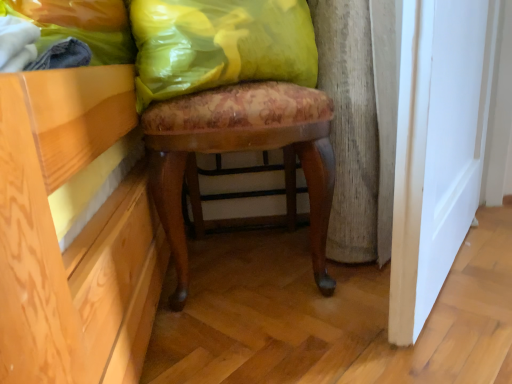
Question: Is yellow fabric pillow at upper center smaller than floral fabric stool at center?

Choices:
 (A) yes
 (B) no

Answer: (A)

Question: Is yellow fabric pillow at upper center positioned beyond the bounds of floral fabric stool at center?

Choices:
 (A) no
 (B) yes

Answer: (A)

Question: Is yellow fabric pillow at upper center at the left side of floral fabric stool at center?

Choices:
 (A) yes
 (B) no

Answer: (A)

Question: Considering the relative sizes of yellow fabric pillow at upper center and floral fabric stool at center in the image provided, is yellow fabric pillow at upper center bigger than floral fabric stool at center?

Choices:
 (A) no
 (B) yes

Answer: (A)

Question: From a real-world perspective, is yellow fabric pillow at upper center over floral fabric stool at center?

Choices:
 (A) no
 (B) yes

Answer: (B)

Question: Is yellow fabric pillow at upper center oriented away from floral fabric stool at center?

Choices:
 (A) no
 (B) yes

Answer: (B)

Question: Could you tell me if floral fabric stool at center is facing yellow fabric pillow at upper center?

Choices:
 (A) no
 (B) yes

Answer: (B)

Question: Considering the relative sizes of floral fabric stool at center and yellow fabric pillow at upper center in the image provided, is floral fabric stool at center smaller than yellow fabric pillow at upper center?

Choices:
 (A) no
 (B) yes

Answer: (A)

Question: Is floral fabric stool at center bigger than yellow fabric pillow at upper center?

Choices:
 (A) no
 (B) yes

Answer: (B)

Question: Is floral fabric stool at center at the left side of yellow fabric pillow at upper center?

Choices:
 (A) yes
 (B) no

Answer: (B)

Question: Is floral fabric stool at center further to camera compared to yellow fabric pillow at upper center?

Choices:
 (A) no
 (B) yes

Answer: (B)

Question: From the image's perspective, is floral fabric stool at center located above yellow fabric pillow at upper center?

Choices:
 (A) yes
 (B) no

Answer: (B)

Question: From a real-world perspective, is yellow fabric pillow at upper center positioned under yellow plastic bag at upper left based on gravity?

Choices:
 (A) no
 (B) yes

Answer: (B)